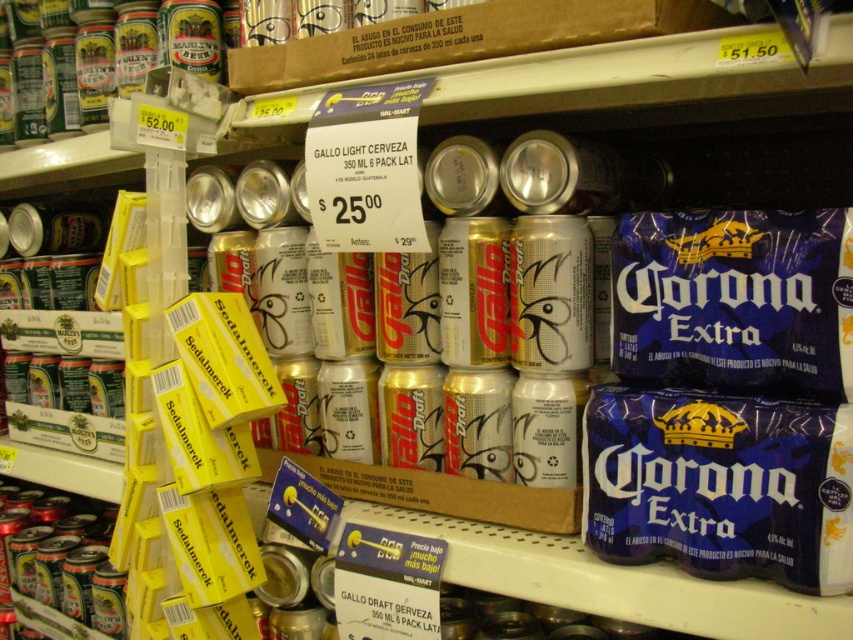
You are a store employee who needs to stack boxes on a shelf. The shelf has limited height. You have two items to place there, the silver metallic cans at center and the gold metallic can at center. Based on their height, which item should you place first to ensure both fit on the shelf?

The silver metallic cans at center is much taller than the gold metallic can at center, so you should place the silver metallic cans at center first to ensure both items fit on the shelf.

You are a customer looking at the grocery store shelf. You see the gold metallic can at upper center and the gold metallic can at center. Which one is located higher on the shelf?

The gold metallic can at upper center is located higher on the shelf than the gold metallic can at center.

Looking at this image, you are a customer in a grocery store looking at the beverage section. You see the silver metallic cans at center and the gold metallic can at center. Which one is placed higher on the shelf?

The silver metallic cans at center are placed higher because they are above the gold metallic can at center.